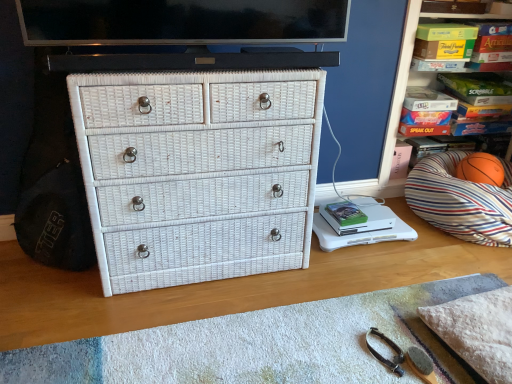
The image size is (512, 384). Find the location of `empty space that is to the right of white plastic changing table at lower right`. empty space that is to the right of white plastic changing table at lower right is located at coordinates (433, 246).